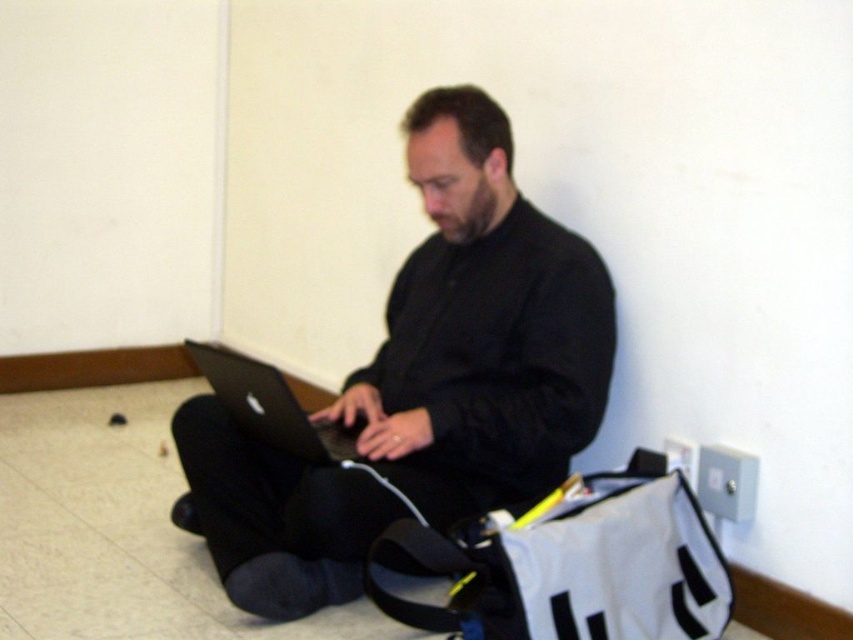
You are trying to locate your laptop. You remember you have a black matte laptop at center and a silver metallic laptop at center. According to the image, which one is positioned to the right?

The black matte laptop at center is positioned to the right of the silver metallic laptop at center.

You need to plug in your laptop charger into an electrical outlet. You see a metallic gray electrical outlet at lower right and a gray plastic electric outlet at lower right. Which one is closer to the floor?

The metallic gray electrical outlet at lower right is below the gray plastic electric outlet at lower right, so it is closer to the floor.